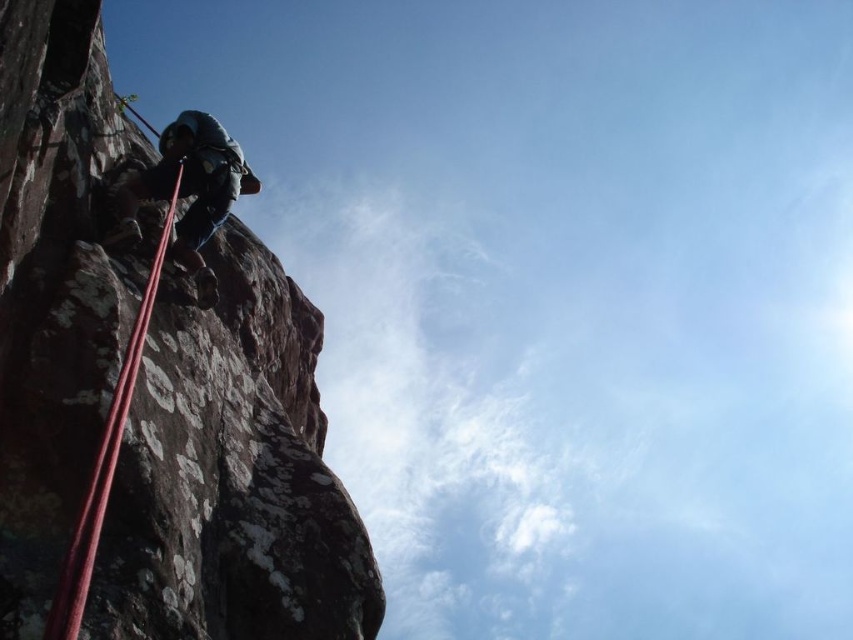
Question: Which point is farther to the camera?

Choices:
 (A) brown rough rock at left
 (B) red nylon rope at left

Answer: (A)

Question: Where is dark blue fabric climbing harness at left located in relation to red nylon rope at left in the image?

Choices:
 (A) right
 (B) left

Answer: (B)

Question: Which point is closer to the camera taking this photo?

Choices:
 (A) (148, 301)
 (B) (282, 317)
 (C) (207, 136)

Answer: (A)

Question: Which object appears farthest from the camera in this image?

Choices:
 (A) dark blue fabric climbing harness at left
 (B) red nylon rope at left
 (C) brown rough rock at left

Answer: (A)

Question: In this image, where is brown rough rock at left located relative to red nylon rope at left?

Choices:
 (A) below
 (B) above

Answer: (A)

Question: Observing the image, what is the correct spatial positioning of brown rough rock at left in reference to dark blue fabric climbing harness at left?

Choices:
 (A) above
 (B) below

Answer: (B)